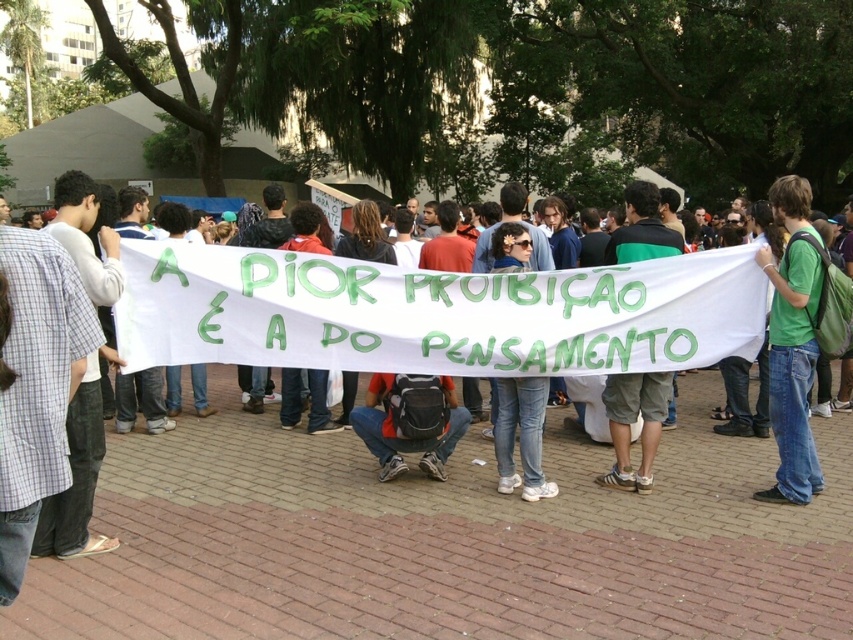
Between white fabric banner at center and green cotton t-shirt at center-right, which one has more height?

Standing taller between the two is green cotton t-shirt at center-right.

Is white fabric banner at center wider than green cotton t-shirt at center-right?

Yes, white fabric banner at center is wider than green cotton t-shirt at center-right.

This screenshot has height=640, width=853. What do you see at coordinates (463, 480) in the screenshot?
I see `white fabric banner at center` at bounding box center [463, 480].

Locate an element on the screen. white fabric banner at center is located at coordinates (463, 480).